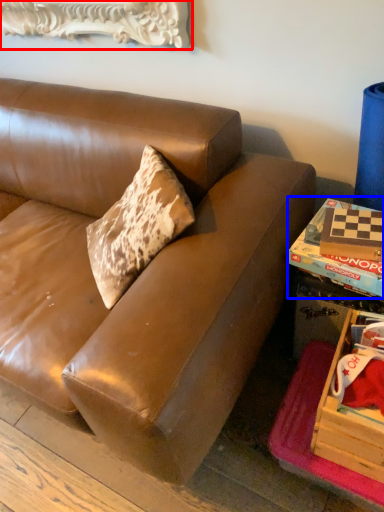
Question: Which of the following is the closest to the observer, picture frame (highlighted by a red box) or book (highlighted by a blue box)?

Choices:
 (A) picture frame
 (B) book

Answer: (B)